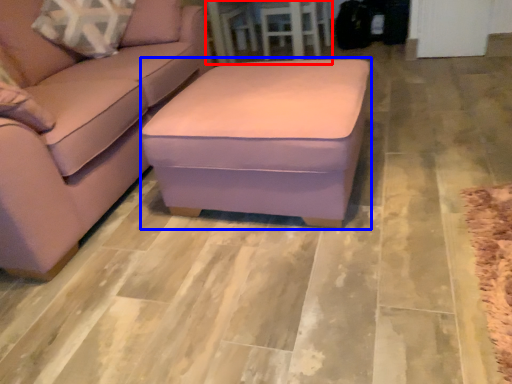
Question: Which object is closer to the camera taking this photo, table (highlighted by a red box) or stool (highlighted by a blue box)?

Choices:
 (A) table
 (B) stool

Answer: (B)